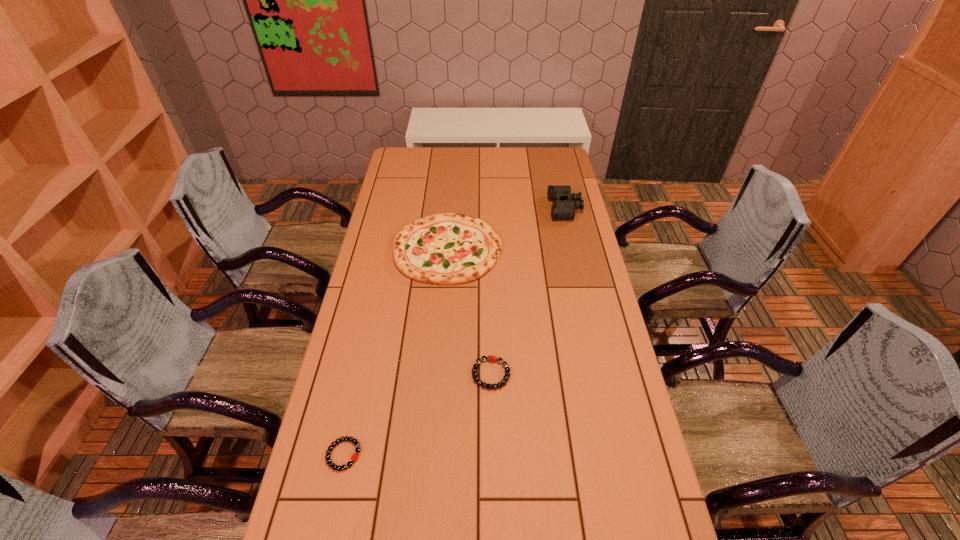
Locate an element on the screen. This screenshot has width=960, height=540. the closest object to the third tallest object is located at coordinates pyautogui.click(x=449, y=248).

Identify which object is the nearest to the binoculars. Please provide its 2D coordinates. Your answer should be formatted as a tuple, i.e. [(x, y)], where the tuple contains the x and y coordinates of a point satisfying the conditions above.

[(449, 248)]

You are a GUI agent. You are given a task and a screenshot of the screen. Output one action in this format:
    pyautogui.click(x=<x>, y=<y>)
    Task: Click on the free location that satisfies the following two spatial constraints: 1. on the back side of the second shortest object; 2. on the left side of the nearer bracelet
    
    Given the screenshot: What is the action you would take?
    pyautogui.click(x=361, y=374)